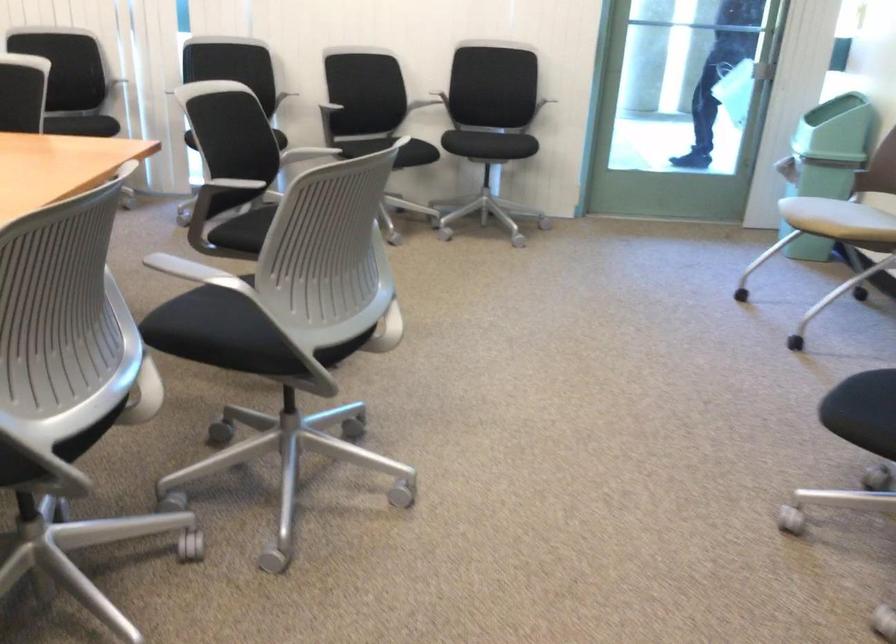
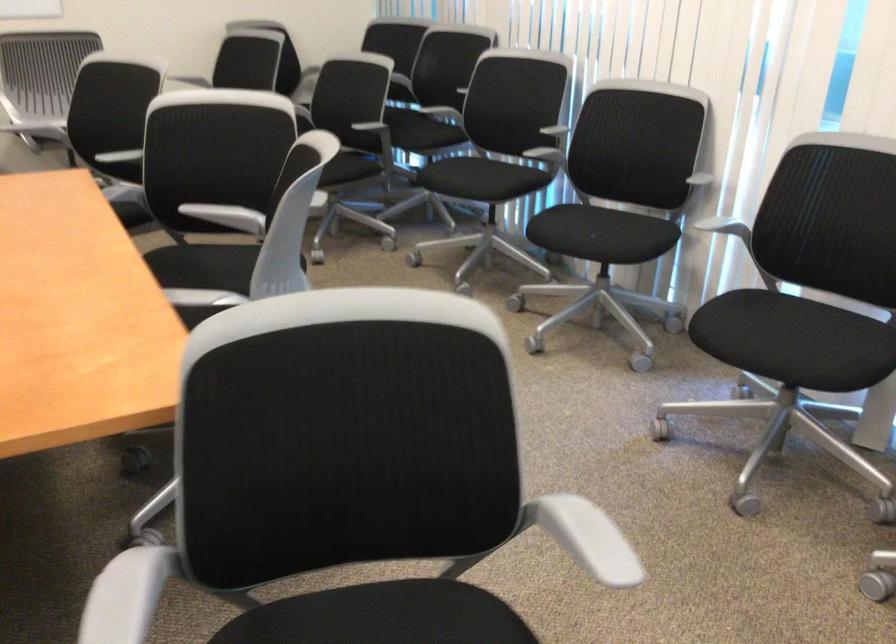
Locate, in the second image, the point that corresponds to pixel 188 79 in the first image.

(725, 228)